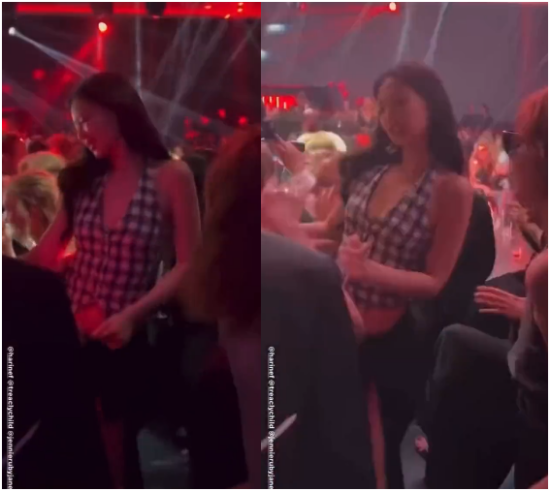
Where is `red spotlight`? red spotlight is located at coordinates (102, 24), (392, 5).